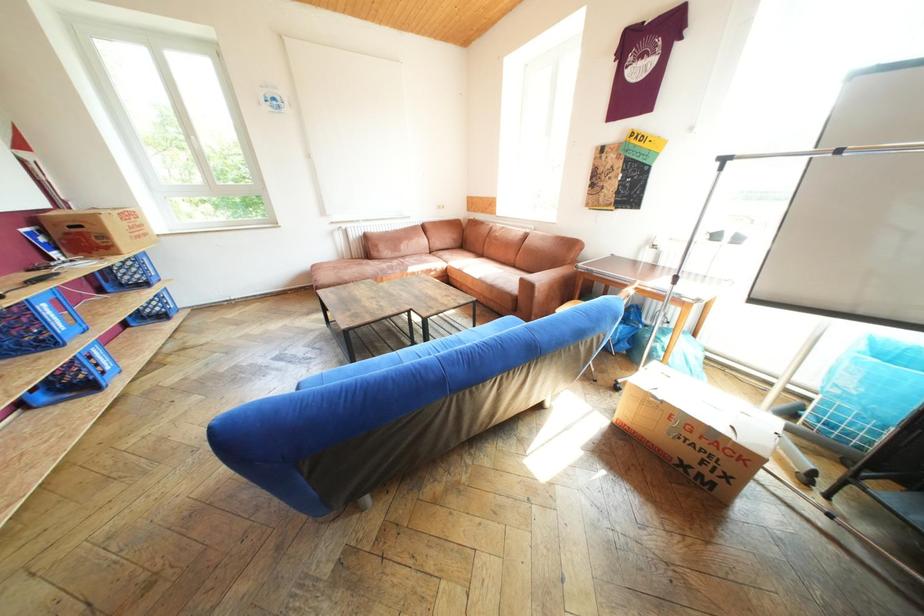
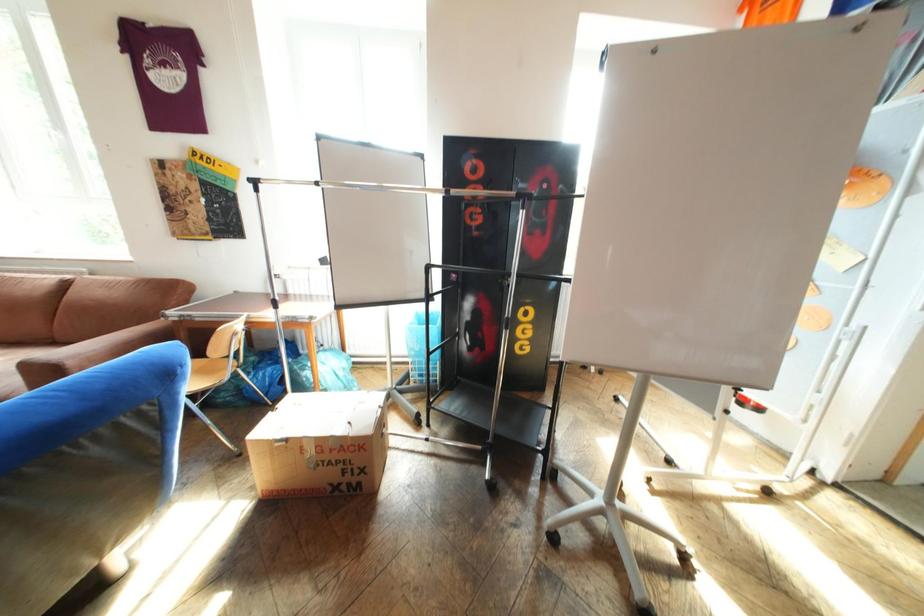
Question: How did the camera likely rotate?

Choices:
 (A) Left
 (B) Right
 (C) Up
 (D) Down

Answer: (B)